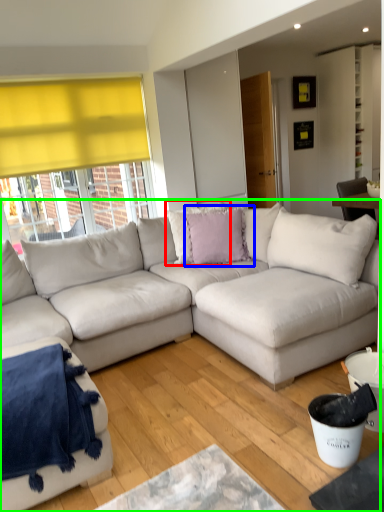
Question: Estimate the real-world distances between objects in this image. Which object is closer to pillow (highlighted by a red box), pillow (highlighted by a blue box) or studio couch (highlighted by a green box)?

Choices:
 (A) pillow
 (B) studio couch

Answer: (A)